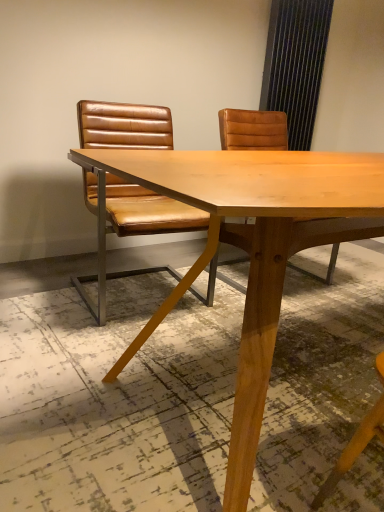
Question: Would you consider brown leather chair at left to be distant from light brown wood table at center?

Choices:
 (A) no
 (B) yes

Answer: (A)

Question: Is brown leather chair at left oriented towards light brown wood table at center?

Choices:
 (A) no
 (B) yes

Answer: (B)

Question: From a real-world perspective, is brown leather chair at left below light brown wood table at center?

Choices:
 (A) yes
 (B) no

Answer: (B)

Question: From the image's perspective, would you say brown leather chair at left is shown under light brown wood table at center?

Choices:
 (A) no
 (B) yes

Answer: (A)

Question: Considering the relative positions of brown leather chair at left and light brown wood table at center in the image provided, is brown leather chair at left behind light brown wood table at center?

Choices:
 (A) yes
 (B) no

Answer: (A)

Question: Can you confirm if brown leather chair at left is thinner than light brown wood table at center?

Choices:
 (A) no
 (B) yes

Answer: (B)

Question: Is light brown wood table at center taller than brown leather chair at left?

Choices:
 (A) no
 (B) yes

Answer: (A)

Question: Can brown leather chair at left be found inside light brown wood table at center?

Choices:
 (A) yes
 (B) no

Answer: (B)

Question: Is light brown wood table at center next to brown leather chair at left and touching it?

Choices:
 (A) yes
 (B) no

Answer: (B)

Question: From the image's perspective, is light brown wood table at center under brown leather chair at left?

Choices:
 (A) no
 (B) yes

Answer: (B)

Question: From the image's perspective, does light brown wood table at center appear higher than brown leather chair at left?

Choices:
 (A) no
 (B) yes

Answer: (A)

Question: Is light brown wood table at center wider than brown leather chair at left?

Choices:
 (A) no
 (B) yes

Answer: (B)

Question: In terms of width, does light brown wood table at center look wider or thinner when compared to brown leather chair at left?

Choices:
 (A) wide
 (B) thin

Answer: (A)